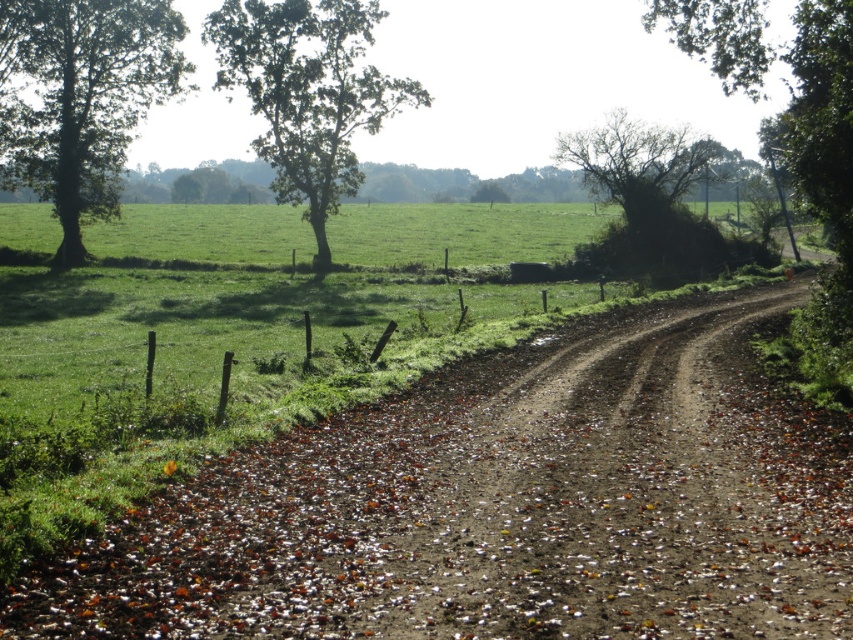
Find the location of a particular element. This screenshot has height=640, width=853. green grass at center is located at coordinates (245, 291).

Between green grass at center and green leafy tree at left, which one has less height?

With less height is green grass at center.

At what (x,y) coordinates should I click in order to perform the action: click on green grass at center. Please return your answer as a coordinate pair (x, y). Looking at the image, I should click on (245, 291).

Is green leafy tree at upper left thinner than bare branches at upper right?

No, green leafy tree at upper left is not thinner than bare branches at upper right.

The height and width of the screenshot is (640, 853). What are the coordinates of `green leafy tree at upper left` in the screenshot? It's located at (306, 93).

Describe the element at coordinates (306, 93) in the screenshot. The image size is (853, 640). I see `green leafy tree at upper left` at that location.

Locate an element on the screen. green leafy tree at upper left is located at coordinates (306, 93).

Which is behind, point (671, 484) or point (173, 36)?

The point (173, 36) is more distant.

Is brown dirt track at center positioned behind green leafy tree at left?

That is False.

Does point (717, 387) come closer to viewer compared to point (113, 68)?

Yes, it is in front of point (113, 68).

Locate an element on the screen. brown dirt track at center is located at coordinates [503, 508].